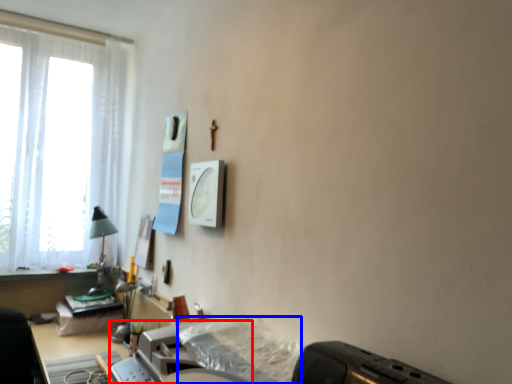
Question: Which of the following is the closest to the observer, printer (highlighted by a red box) or sheet (highlighted by a blue box)?

Choices:
 (A) printer
 (B) sheet

Answer: (B)